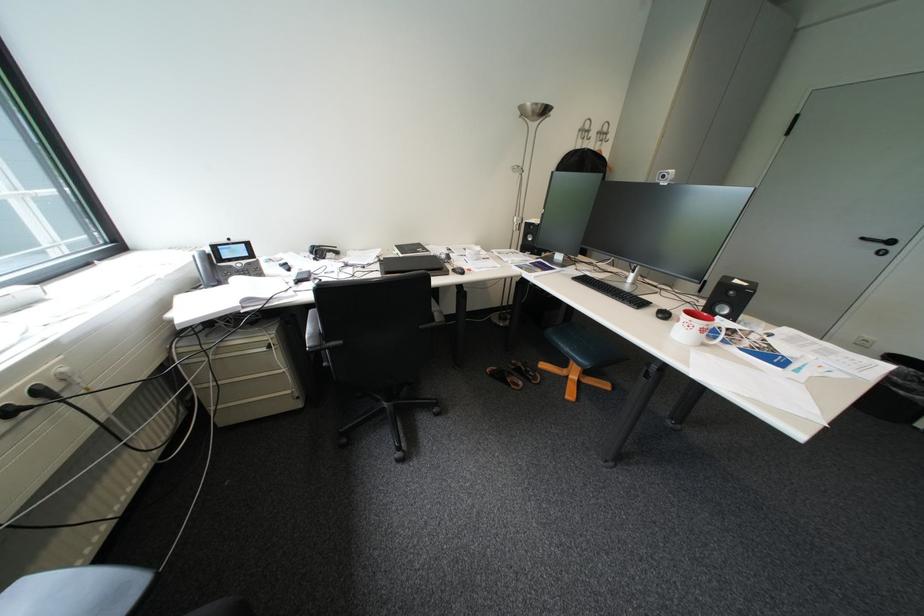
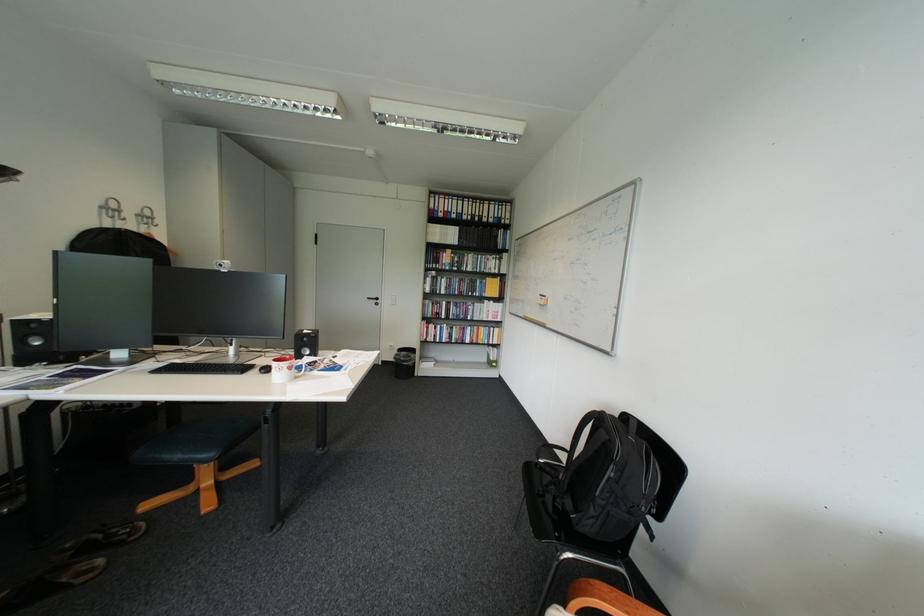
In the second image, find the point that corresponds to [678,315] in the first image.

(281, 370)